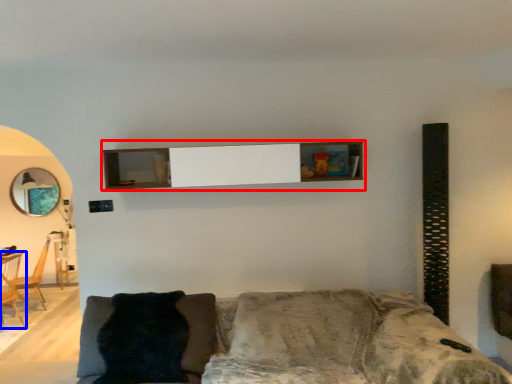
Question: Which object is closer to the camera taking this photo, shelf (highlighted by a red box) or armchair (highlighted by a blue box)?

Choices:
 (A) shelf
 (B) armchair

Answer: (A)